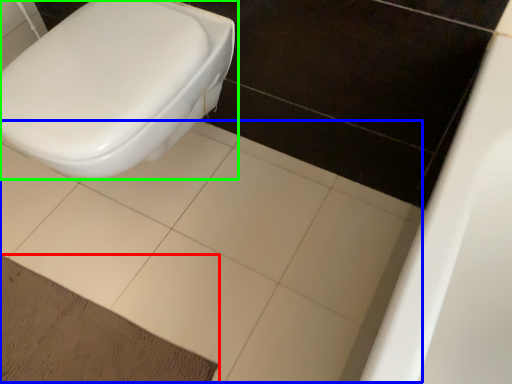
Question: Which object is the farthest from doormat (highlighted by a red box)? Choose among these: ceramic tile (highlighted by a blue box) or toilet (highlighted by a green box).

Choices:
 (A) ceramic tile
 (B) toilet

Answer: (B)